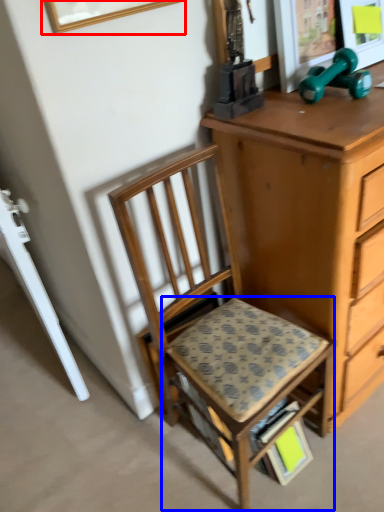
Question: Which point is closer to the camera, picture frame (highlighted by a red box) or step stool (highlighted by a blue box)?

Choices:
 (A) picture frame
 (B) step stool

Answer: (A)